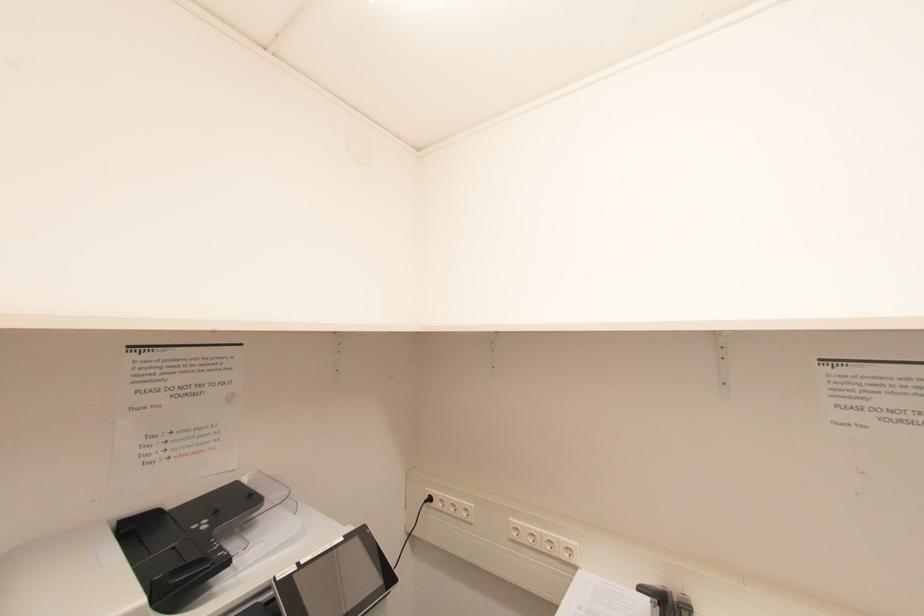
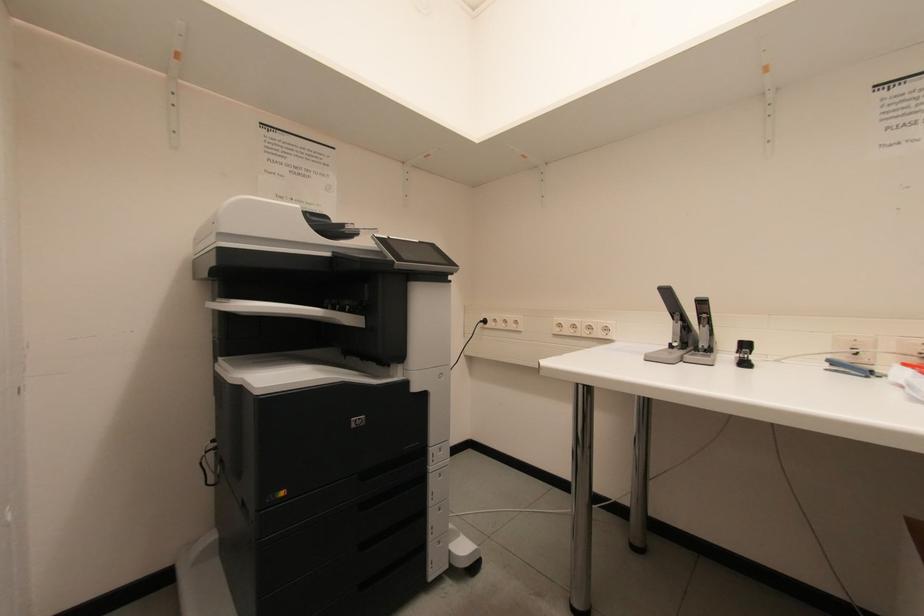
Question: Which direction would the cameraman need to move to produce the second image? Reply with the corresponding letter.

Choices:
 (A) Left
 (B) Right
 (C) Forward
 (D) Backward

Answer: (D)